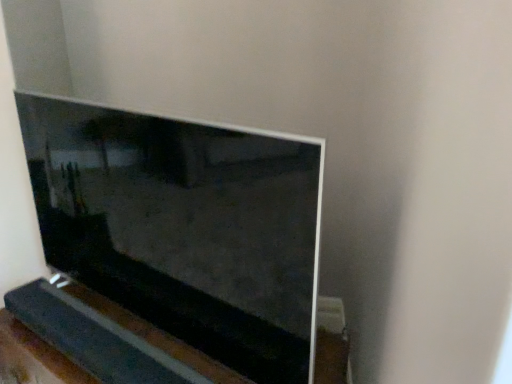
This screenshot has width=512, height=384. What are the coordinates of `blank space situated above black wood at lower left (from a real-world perspective)` in the screenshot? It's located at (93, 334).